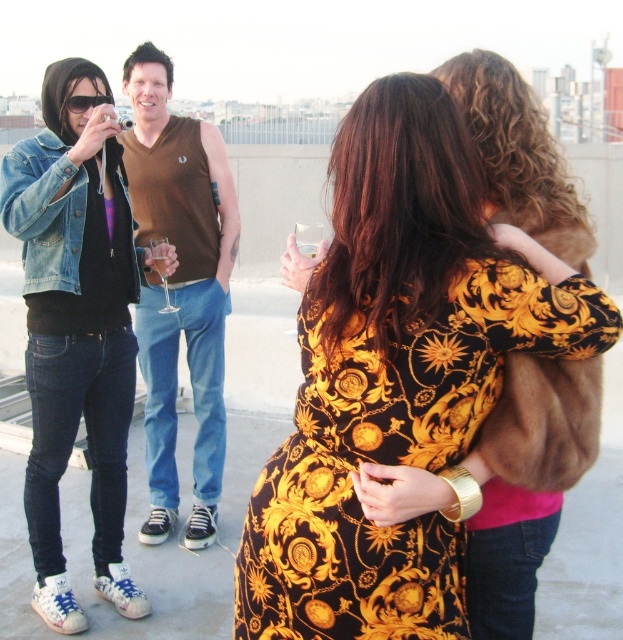
Question: Is denim jacket at left smaller than clear glass wine glass at center?

Choices:
 (A) yes
 (B) no

Answer: (B)

Question: Among these objects, which one is nearest to the camera?

Choices:
 (A) gold-patterned dress at center
 (B) denim jacket at left
 (C) clear glass wine glass at center

Answer: (A)

Question: Based on their relative distances, which object is farther from the denim jacket at left?

Choices:
 (A) clear glass wine glass at center
 (B) gold-patterned dress at center

Answer: (B)

Question: Which object is the closest to the gold-patterned dress at center?

Choices:
 (A) clear glass wine glass at center
 (B) denim jacket at left

Answer: (B)

Question: Where is denim jacket at left located in relation to clear glass wine glass at center in the image?

Choices:
 (A) below
 (B) above

Answer: (A)

Question: Does brown sleeveless shirt at center have a lesser width compared to clear glass wine glass at center?

Choices:
 (A) no
 (B) yes

Answer: (A)